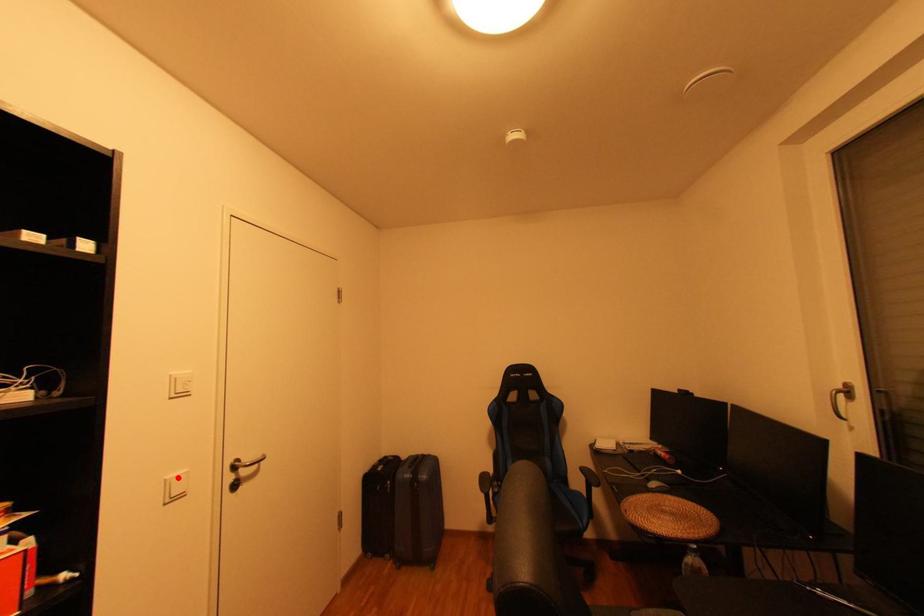
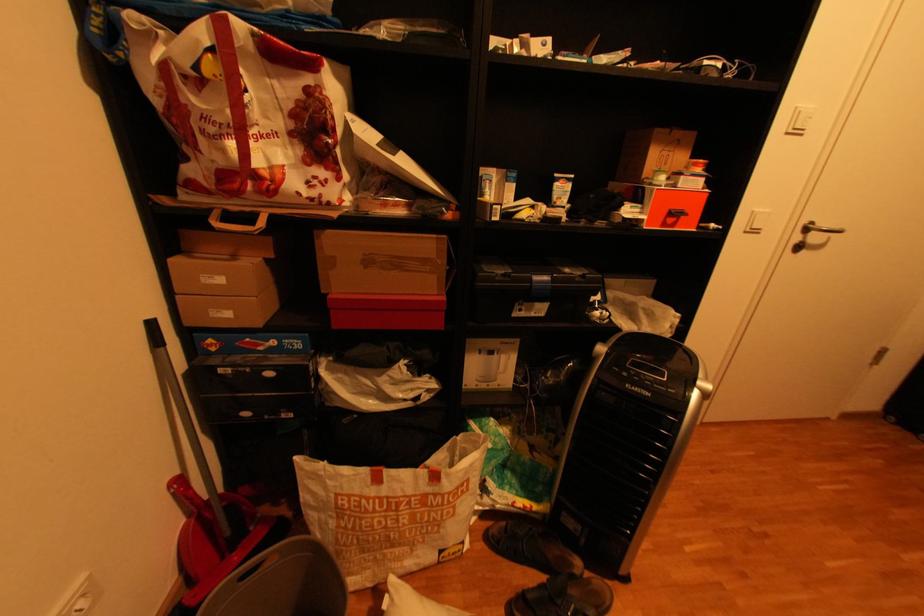
Locate, in the second image, the point that corresponds to the highlighted location in the first image.

(766, 209)